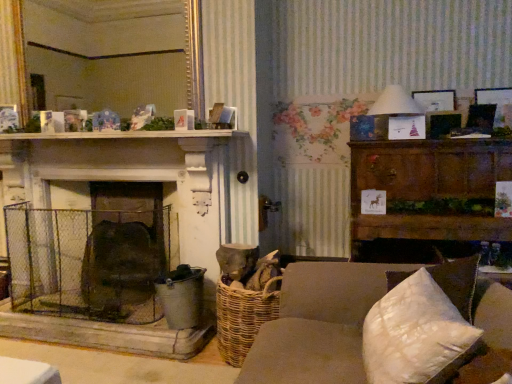
Question: Is rusty wire mesh fireplace screen at center-left far away from white wooden mantle at upper center?

Choices:
 (A) no
 (B) yes

Answer: (A)

Question: Can you confirm if rusty wire mesh fireplace screen at center-left is positioned to the right of white wooden mantle at upper center?

Choices:
 (A) no
 (B) yes

Answer: (A)

Question: Does rusty wire mesh fireplace screen at center-left have a lesser width compared to white wooden mantle at upper center?

Choices:
 (A) yes
 (B) no

Answer: (B)

Question: Is rusty wire mesh fireplace screen at center-left shorter than white wooden mantle at upper center?

Choices:
 (A) no
 (B) yes

Answer: (A)

Question: Would you say rusty wire mesh fireplace screen at center-left is outside white wooden mantle at upper center?

Choices:
 (A) no
 (B) yes

Answer: (B)

Question: Are rusty wire mesh fireplace screen at center-left and white wooden mantle at upper center beside each other?

Choices:
 (A) no
 (B) yes

Answer: (A)

Question: From the image's perspective, is dark brown wood cabinet at right located beneath white wooden mantle at upper center?

Choices:
 (A) no
 (B) yes

Answer: (B)

Question: Is dark brown wood cabinet at right to the right of white wooden mantle at upper center from the viewer's perspective?

Choices:
 (A) yes
 (B) no

Answer: (A)

Question: Can you confirm if dark brown wood cabinet at right is smaller than white wooden mantle at upper center?

Choices:
 (A) no
 (B) yes

Answer: (A)

Question: Is dark brown wood cabinet at right at the left side of white wooden mantle at upper center?

Choices:
 (A) yes
 (B) no

Answer: (B)

Question: Is dark brown wood cabinet at right directly adjacent to white wooden mantle at upper center?

Choices:
 (A) yes
 (B) no

Answer: (B)

Question: Is dark brown wood cabinet at right turned away from white wooden mantle at upper center?

Choices:
 (A) no
 (B) yes

Answer: (A)

Question: Does dark brown wood cabinet at right contain gold-framed mirror at upper center?

Choices:
 (A) no
 (B) yes

Answer: (A)